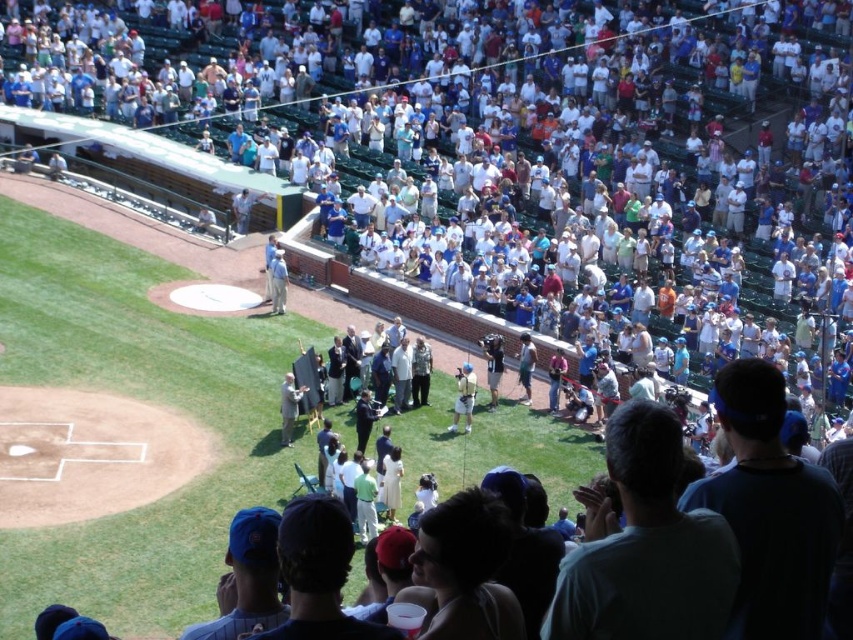
You are standing at the point labeled point (276,298) and want to move to the point labeled point (474,378). Since you can only move forward, will you be able to reach the destination without moving sideways or backward?

Yes, you can reach the destination because point (474,378) is closer to the camera than point (276,298), so moving forward will bring you towards it.

You are a photographer at the baseball stadium and need to capture a clear photo of both the white jersey at center and the white cotton shirt at center. Which object should you adjust your camera focus to first to ensure both are in the frame?

The white jersey at center is below the white cotton shirt at center, so you should focus on the white cotton shirt at center first to ensure the white jersey at center is within the frame.

You are standing at the entrance of the baseball stadium and want to reach the point marked at coordinates point [469,371]. If your walking speed is 3 feet per second, how many seconds will it take you to reach that point?

The distance of point [469,371] from viewer is 161.84 feet. At a speed of 3 feet per second, it will take approximately 53.95 seconds to reach the point.